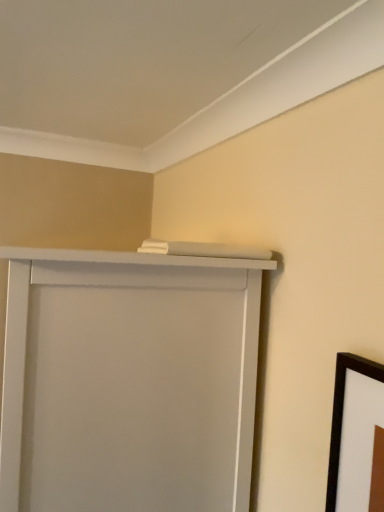
The image size is (384, 512). What do you see at coordinates (129, 381) in the screenshot?
I see `white matte blind at upper center` at bounding box center [129, 381].

In order to face white matte blind at upper center, should I rotate leftwards or rightwards?

It's best to rotate left around 13.021 degrees.

Find the location of a particular element. The width and height of the screenshot is (384, 512). white matte blind at upper center is located at coordinates (129, 381).

The height and width of the screenshot is (512, 384). I want to click on white matte blind at upper center, so click(129, 381).